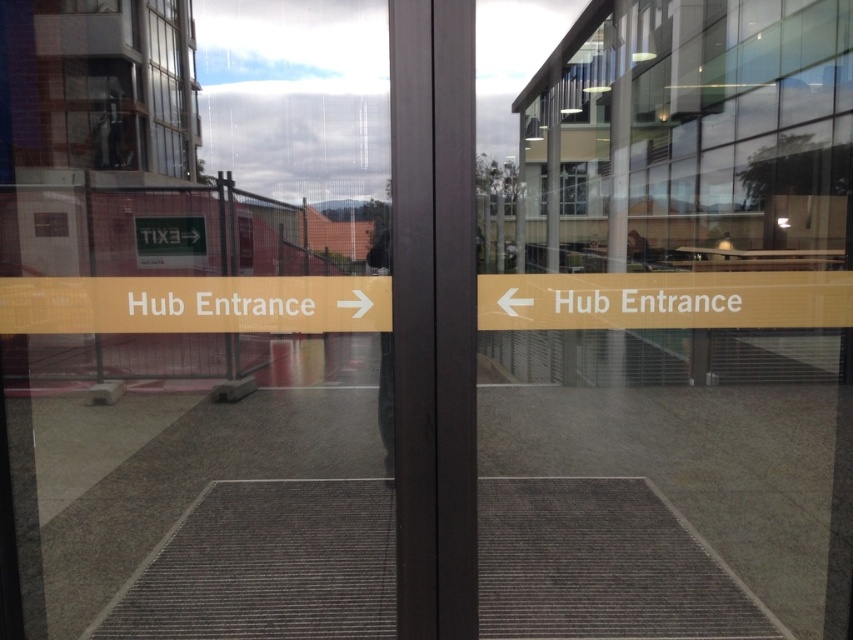
Question: Among these objects, which one is farthest from the camera?

Choices:
 (A) transparent glass door at center
 (B) clear glass window at upper left

Answer: (B)

Question: Is transparent glass door at center further to the viewer compared to clear glass window at upper left?

Choices:
 (A) yes
 (B) no

Answer: (B)

Question: Is transparent glass door at center wider than clear glass window at upper left?

Choices:
 (A) no
 (B) yes

Answer: (B)

Question: Can you confirm if transparent glass door at center is thinner than clear glass window at upper left?

Choices:
 (A) no
 (B) yes

Answer: (A)